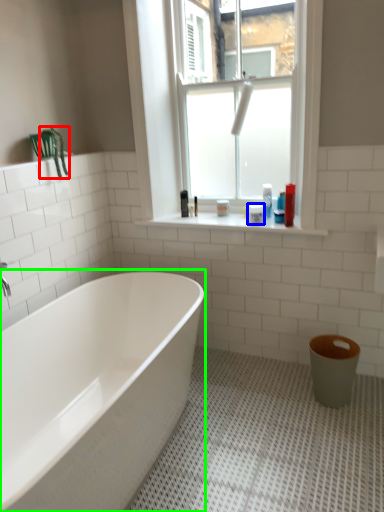
Question: Considering the real-world distances, which object is closest to plant (highlighted by a red box)? toiletry (highlighted by a blue box) or bathtub (highlighted by a green box).

Choices:
 (A) toiletry
 (B) bathtub

Answer: (A)